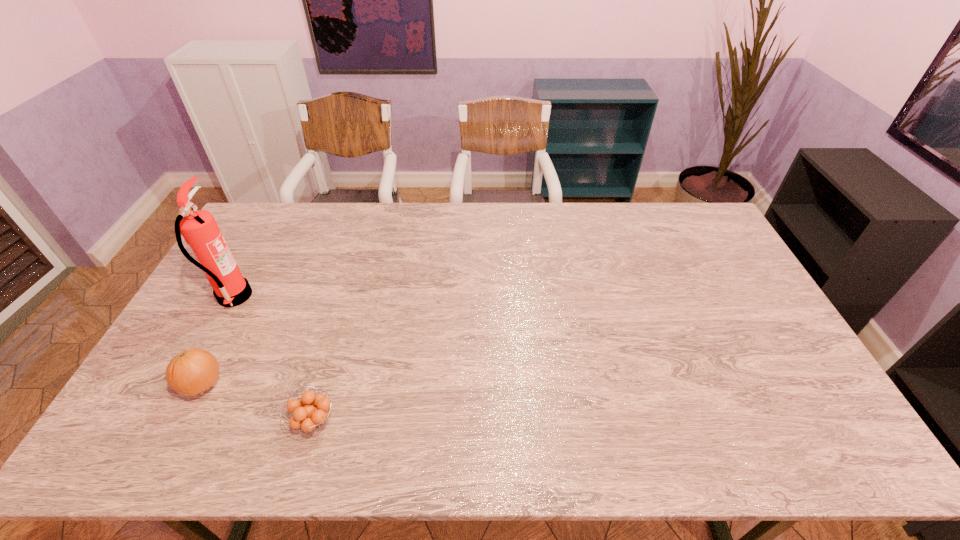
Image resolution: width=960 pixels, height=540 pixels. In order to click on free space in the image that satisfies the following two spatial constraints: 1. on the front side of the taller orange fruit; 2. on the right side of the shortest object in this screenshot , I will do coord(183,421).

I want to click on vacant space that satisfies the following two spatial constraints: 1. with the nozzle aimed from the shorter orange fruit; 2. on the right side of the fire extinguisher, so click(166, 421).

The height and width of the screenshot is (540, 960). What are the coordinates of `vacant space that satisfies the following two spatial constraints: 1. on the back side of the left orange fruit; 2. with the nozzle aimed from the tallest object` in the screenshot? It's located at (248, 297).